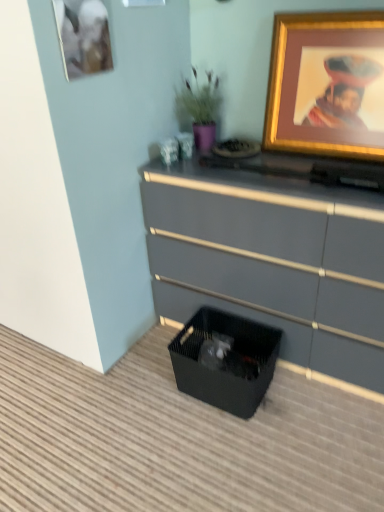
Locate an element on the screen. This screenshot has width=384, height=512. free spot to the right of black mesh storage box at lower center is located at coordinates (309, 400).